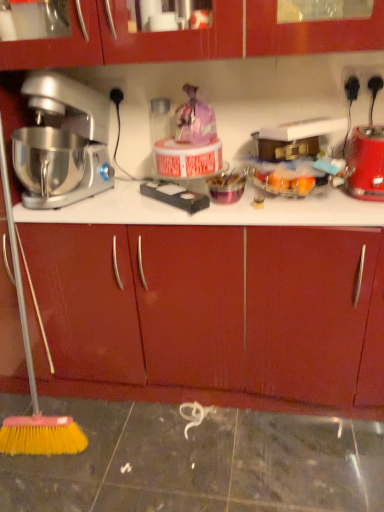
Question: Are red plastic blender at right and matte wood drawer at center beside each other?

Choices:
 (A) no
 (B) yes

Answer: (A)

Question: Does red plastic blender at right have a lesser width compared to matte wood drawer at center?

Choices:
 (A) yes
 (B) no

Answer: (A)

Question: From a real-world perspective, does red plastic blender at right stand above matte wood drawer at center?

Choices:
 (A) yes
 (B) no

Answer: (A)

Question: From the image's perspective, does red plastic blender at right appear lower than matte wood drawer at center?

Choices:
 (A) yes
 (B) no

Answer: (B)

Question: Can you confirm if red plastic blender at right is positioned to the right of matte wood drawer at center?

Choices:
 (A) yes
 (B) no

Answer: (A)

Question: Based on their positions, is matte wood drawer at center located to the left or right of silver metallic mixer at left?

Choices:
 (A) right
 (B) left

Answer: (A)

Question: Is point [74, 377] closer or farther from the camera than point [99, 140]?

Choices:
 (A) farther
 (B) closer

Answer: (A)

Question: Considering the positions of matte wood drawer at center and silver metallic mixer at left in the image, is matte wood drawer at center wider or thinner than silver metallic mixer at left?

Choices:
 (A) thin
 (B) wide

Answer: (A)

Question: Considering the positions of matte wood drawer at center and silver metallic mixer at left in the image, is matte wood drawer at center bigger or smaller than silver metallic mixer at left?

Choices:
 (A) small
 (B) big

Answer: (B)

Question: Based on their sizes in the image, would you say red plastic blender at right is bigger or smaller than matte wood drawer at center?

Choices:
 (A) small
 (B) big

Answer: (A)

Question: From a real-world perspective, is red plastic blender at right above or below matte wood drawer at center?

Choices:
 (A) above
 (B) below

Answer: (A)

Question: Is red plastic blender at right inside the boundaries of matte wood drawer at center, or outside?

Choices:
 (A) inside
 (B) outside

Answer: (B)

Question: From the image's perspective, is red plastic blender at right located above or below matte wood drawer at center?

Choices:
 (A) below
 (B) above

Answer: (B)

Question: Relative to red plastic blender at right, is matte wood drawer at center in front or behind?

Choices:
 (A) front
 (B) behind

Answer: (A)

Question: Visually, is matte wood drawer at center positioned to the left or to the right of red plastic blender at right?

Choices:
 (A) right
 (B) left

Answer: (B)